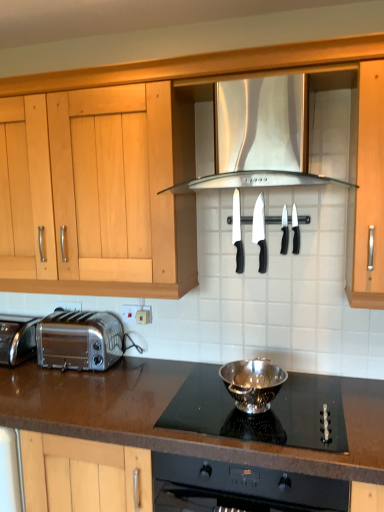
Question: Considering the positions of point (299, 181) and point (292, 237), is point (299, 181) closer or farther from the camera than point (292, 237)?

Choices:
 (A) farther
 (B) closer

Answer: (B)

Question: Considering the relative positions of stainless steel exhaust hood at center and black plastic knife at upper center, arranged as the fourth kitchen appliance when viewed from the back, in the image provided, is stainless steel exhaust hood at center to the left or to the right of black plastic knife at upper center, arranged as the fourth kitchen appliance when viewed from the back,?

Choices:
 (A) left
 (B) right

Answer: (A)

Question: Which object is the closest to the black plastic knife at center, positioned as the fourth kitchen appliance in front-to-back order?

Choices:
 (A) brown granite countertop at lower center
 (B) black plastic knife at center, the 5th kitchen appliance from the front
 (C) silver metallic bowl at center, the 1th kitchen appliance in the front-to-back sequence
 (D) black plastic knife at upper center, the 2th kitchen appliance in the front-to-back sequence
 (E) stainless steel exhaust hood at center

Answer: (B)

Question: Estimate the real-world distances between objects in this image. Which object is farther from the black plastic knife at center, marked as the 3th kitchen appliance in a back-to-front arrangement?

Choices:
 (A) silver metallic bowl at center, the 5th kitchen appliance from the back
 (B) black plastic knife at center, positioned as the fourth kitchen appliance in front-to-back order
 (C) black plastic knife at upper center, the 2th kitchen appliance in the front-to-back sequence
 (D) stainless steel exhaust hood at center
 (E) polished stainless steel bowl at center

Answer: (E)